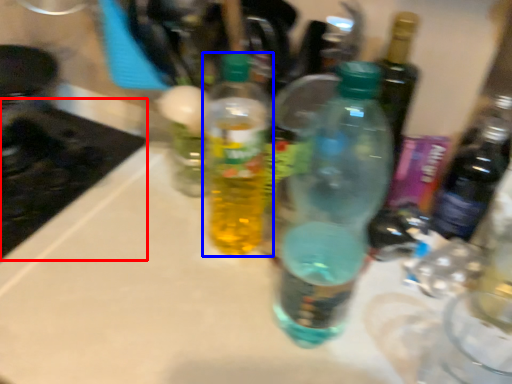
Question: Which object is closer to the camera taking this photo, appliance (highlighted by a red box) or bottle (highlighted by a blue box)?

Choices:
 (A) appliance
 (B) bottle

Answer: (B)